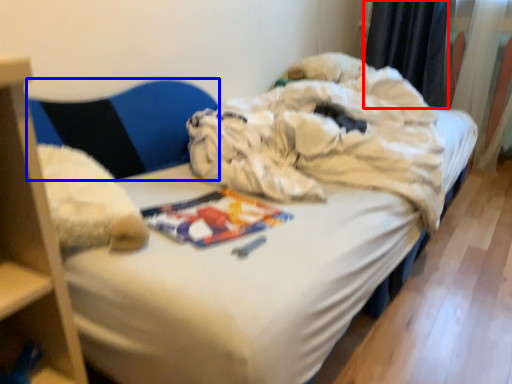
Question: Which object appears closest to the camera in this image, curtain (highlighted by a red box) or armchair (highlighted by a blue box)?

Choices:
 (A) curtain
 (B) armchair

Answer: (B)